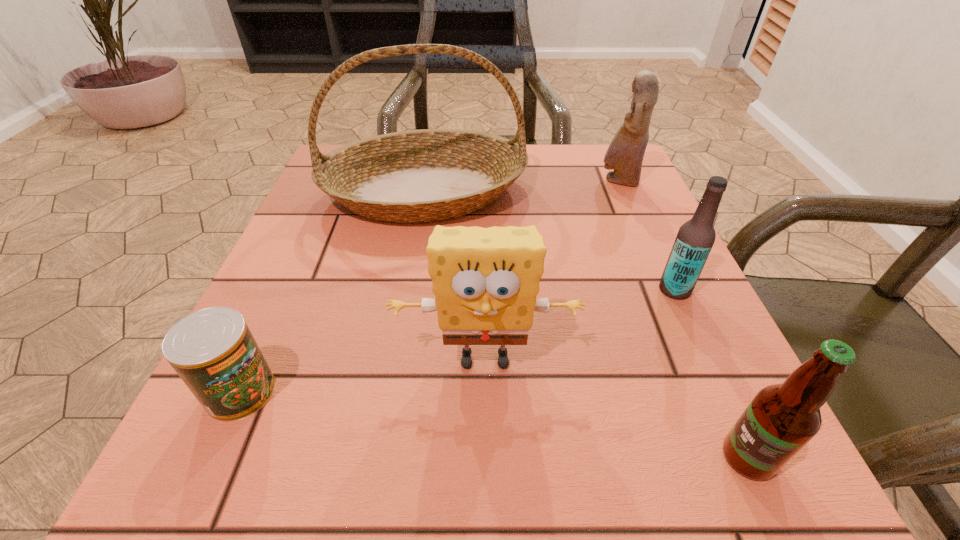
Locate an element on the screen. This screenshot has width=960, height=540. free space at the right edge of the desktop is located at coordinates click(x=639, y=306).

At what (x,y) coordinates should I click in order to perform the action: click on vacant point at the near left corner. Please return your answer as a coordinate pair (x, y). This screenshot has width=960, height=540. Looking at the image, I should click on (239, 471).

In the image, there is a desktop. Where is `free space at the far right corner`? Image resolution: width=960 pixels, height=540 pixels. free space at the far right corner is located at coordinates (608, 197).

This screenshot has height=540, width=960. I want to click on vacant area that lies between the farther beer bottle and the nearest object, so click(711, 374).

At what (x,y) coordinates should I click in order to perform the action: click on vacant area between the can and the figurine. Please return your answer as a coordinate pair (x, y). Looking at the image, I should click on (430, 287).

You are a GUI agent. You are given a task and a screenshot of the screen. Output one action in this format:
    pyautogui.click(x=<x>, y=<y>)
    Task: Click on the free space between the basket and the farther beer bottle
    
    Given the screenshot: What is the action you would take?
    pyautogui.click(x=550, y=241)

Image resolution: width=960 pixels, height=540 pixels. What are the coordinates of `free space between the sponge and the can` in the screenshot? It's located at (363, 375).

Where is `unoccupied position between the sponge and the fourth nearest object`? unoccupied position between the sponge and the fourth nearest object is located at coordinates (580, 323).

You are a GUI agent. You are given a task and a screenshot of the screen. Output one action in this format:
    pyautogui.click(x=<x>, y=<y>)
    Task: Click on the vacant region between the fourth nearest object and the figurine
    The width and height of the screenshot is (960, 540).
    Given the screenshot: What is the action you would take?
    pyautogui.click(x=646, y=235)

Find the location of a particular element. unoccupied area between the nearest object and the figurine is located at coordinates (684, 319).